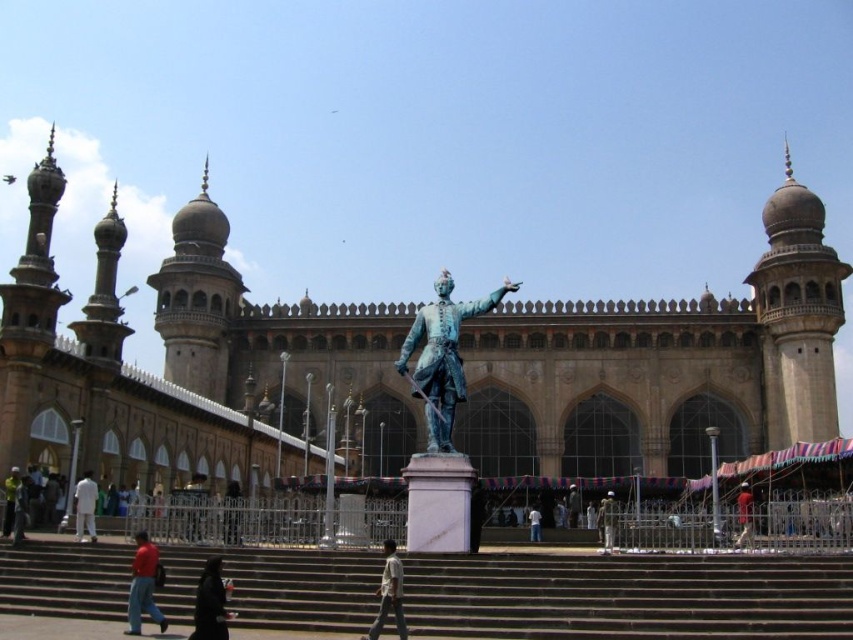
In the scene shown: You are standing in front of the grand architectural structure with the statue. You notice two points marked in the scene. Which point, point (467, 316) or point (206, 600), is closer to you?

Point (467, 316) is closer to you because it is further to the viewer than point (206, 600).

You are a photographer planning to capture the grand monument with its statue and the jacket in the frame. Given that your camera has a 1.5 meter wide field of view, will you be able to fit both the metallic statue at center and the light brown leather jacket at lower left in the frame without moving the camera?

The metallic statue at center might be wider than light brown leather jacket at lower left. However, since the exact width isn not specified, it is uncertain if both will fit within the 1.5 meter field of view. Check the actual dimensions before deciding.